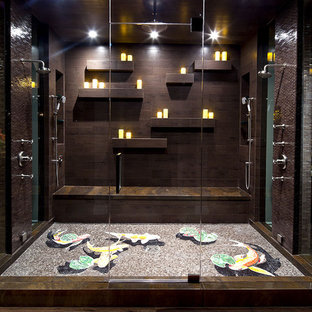
Image resolution: width=312 pixels, height=312 pixels. Find the location of `place to sit`. place to sit is located at coordinates (164, 194).